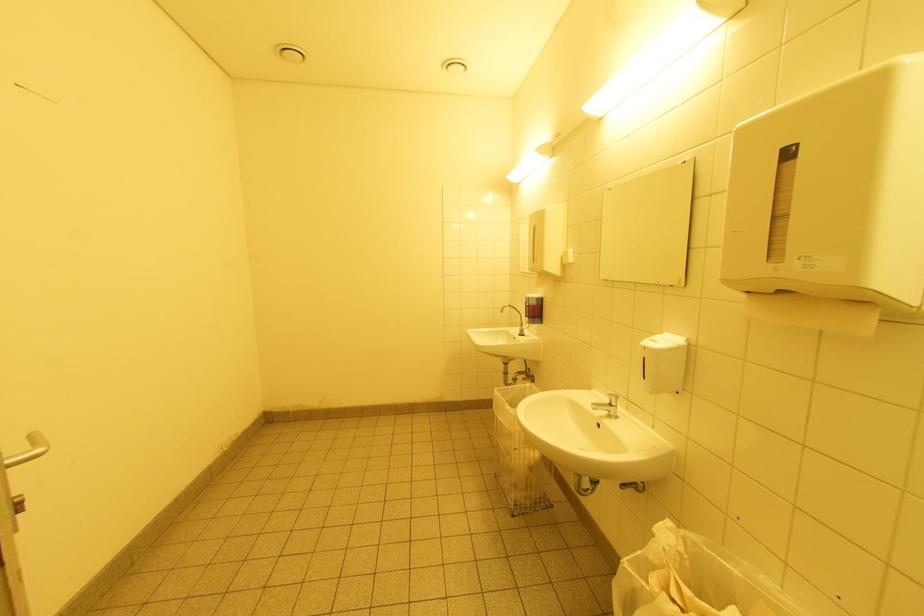
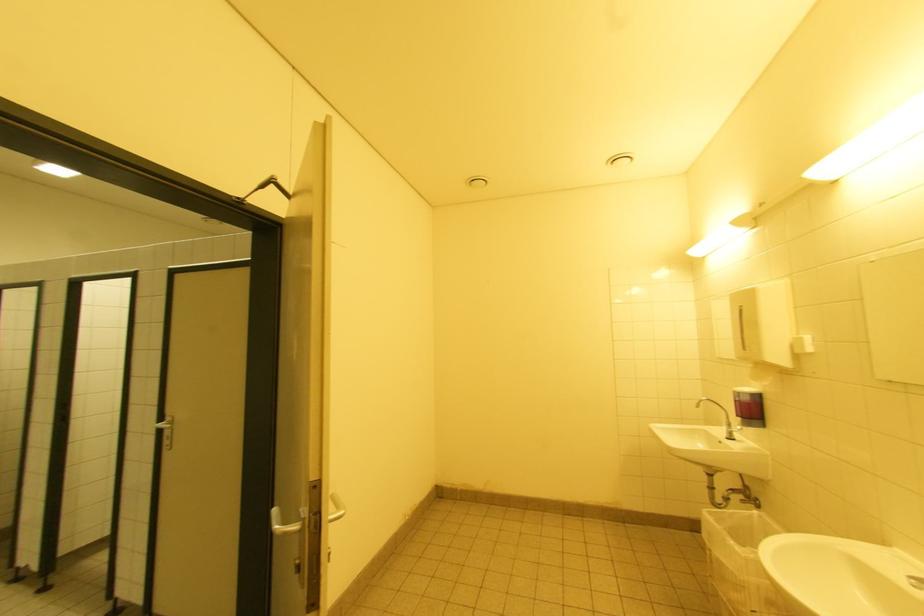
In a continuous first-person perspective shot, in which direction is the camera moving?

The cameraman walked toward left, backward.